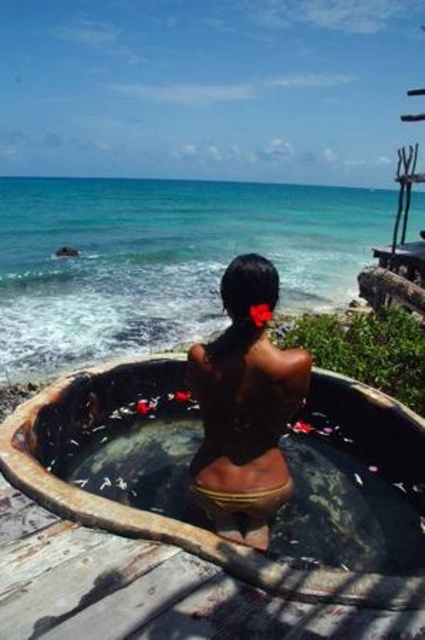
You are a photographer positioned at the origin point of the coordinate system. You want to capture the rustic stone tub at center in your shot. Given that the tub is located at coordinates point 0.814, 0.466, can you estimate its position relative to the center of the image?

The rustic stone tub at center is located at coordinates point (198,520), which means it is positioned to the right and slightly above the center of the image.

You are designing a new spa and want to ensure the rustic stone tub at center is visually balanced with the black matte swimsuit at center. Given their heights, which object should be placed on a higher platform to achieve this balance?

The rustic stone tub at center has a lesser height compared to the black matte swimsuit at center. To achieve visual balance, the rustic stone tub at center should be placed on a higher platform so that its elevated position compensates for its shorter stature, balancing it with the taller black matte swimsuit at center.

You are a lifeguard on duty and you see the smooth concrete tub at center and the black matte swimsuit at center in the image. Which object is higher in height?

The smooth concrete tub at center is taller than the black matte swimsuit at center.